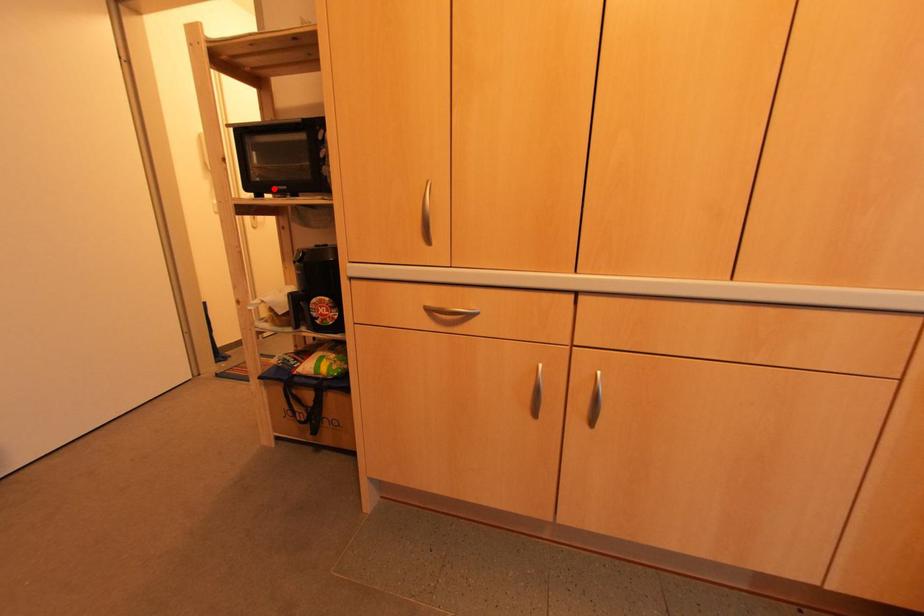
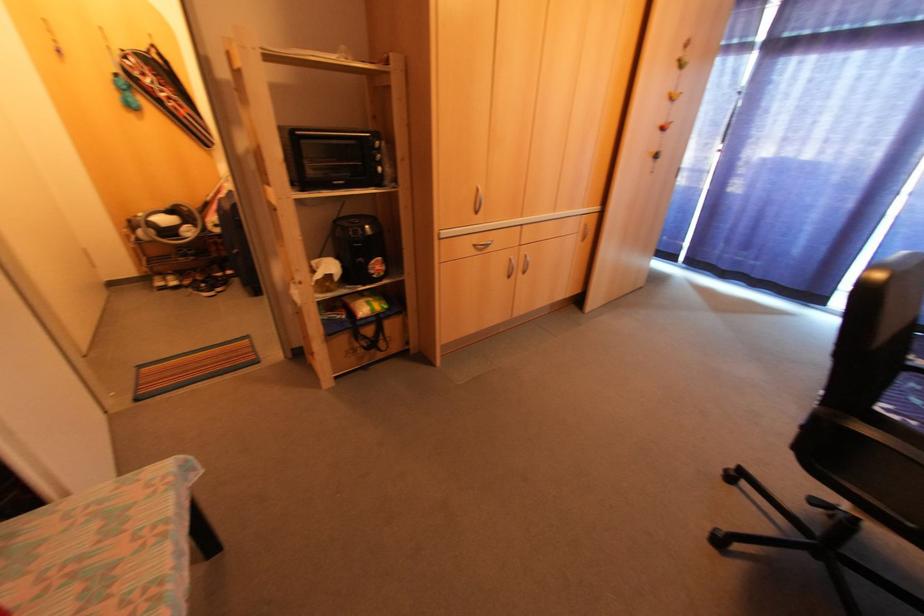
Question: I am providing you with two images of the same scene from different viewpoints. Image1 has a red point marked. In image2, the corresponding 3D location appears at what relative position? Reply with the corresponding letter.

Choices:
 (A) Closer
 (B) Farther

Answer: (A)